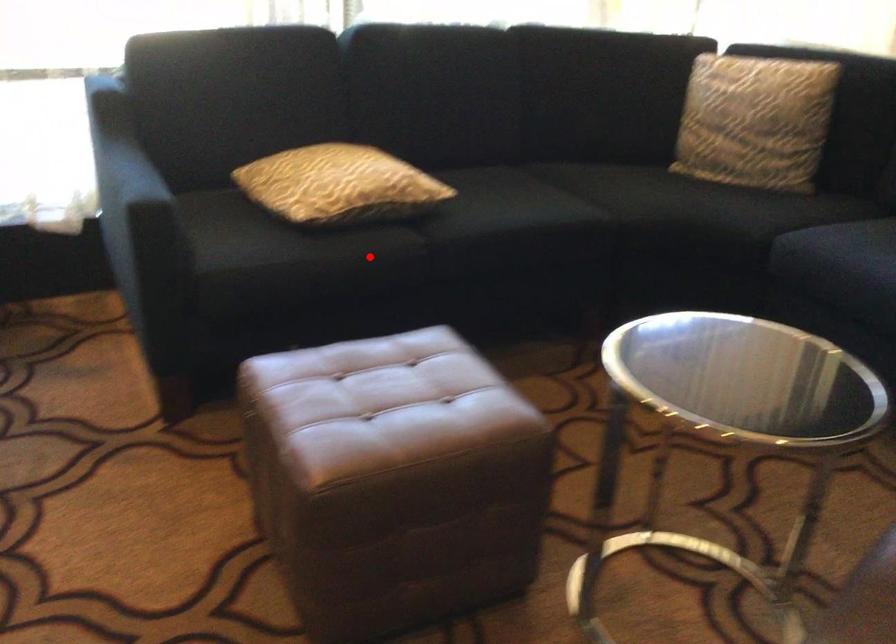
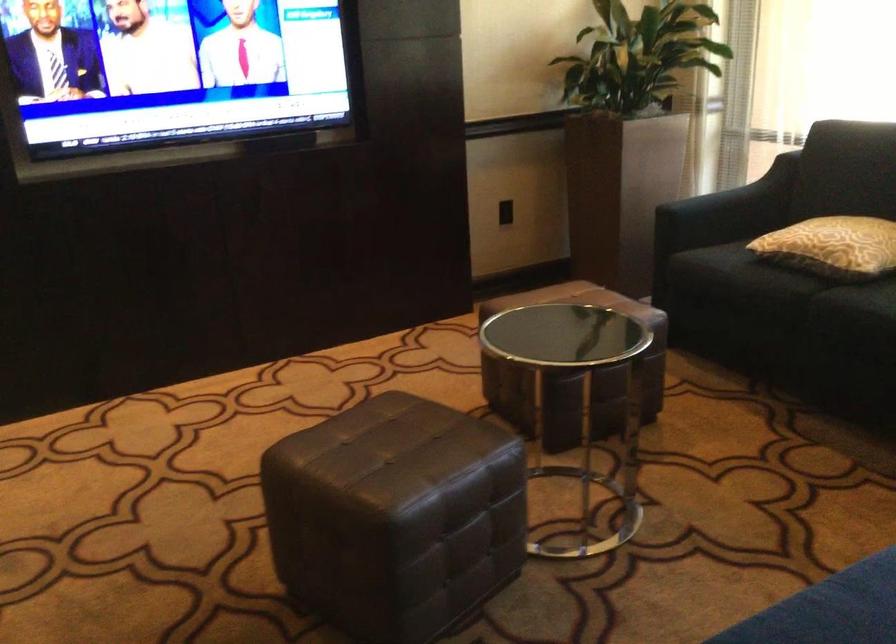
Question: I am providing you with two images of the same scene from different viewpoints. A red point is marked on the first image. At the location where the point appears in image 1, is it still visible in image 2?

Choices:
 (A) Yes
 (B) No

Answer: (A)